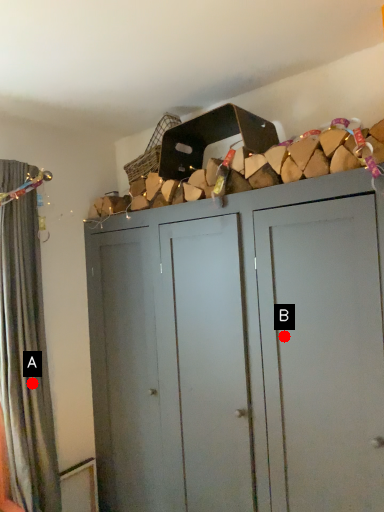
Question: Two points are circled on the image, labeled by A and B beside each circle. Which point is closer to the camera?

Choices:
 (A) A is closer
 (B) B is closer

Answer: (B)